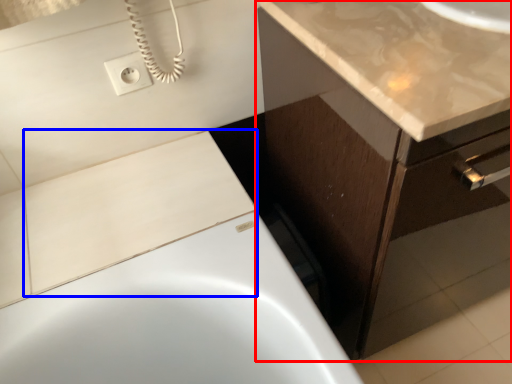
Question: Which object appears closest to the camera in this image, bathroom cabinet (highlighted by a red box) or tile (highlighted by a blue box)?

Choices:
 (A) bathroom cabinet
 (B) tile

Answer: (A)